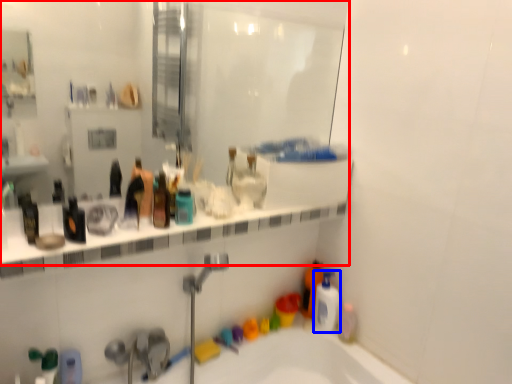
Question: Among these objects, which one is nearest to the camera, mirror (highlighted by a red box) or mouthwash (highlighted by a blue box)?

Choices:
 (A) mirror
 (B) mouthwash

Answer: (A)